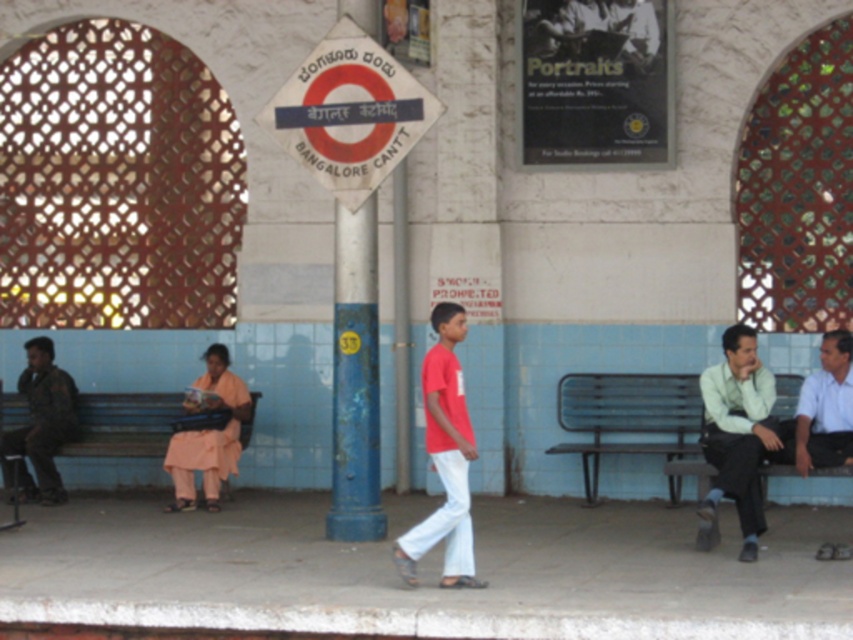
Question: Is white plastic sign at center to the right of blue painted metal pole at center from the viewer's perspective?

Choices:
 (A) no
 (B) yes

Answer: (A)

Question: Based on their relative distances, which object is farther from the red matte shirt at center?

Choices:
 (A) white plastic sign at center
 (B) matte pink dress at center
 (C) dark brown leather jacket at left
 (D) blue painted metal pole at center

Answer: (C)

Question: Is blue painted metal pole at center above light green shirt at right?

Choices:
 (A) no
 (B) yes

Answer: (B)

Question: Which point is farther to the camera?

Choices:
 (A) red matte shirt at center
 (B) matte pink dress at center
 (C) blue painted wood bench at center left

Answer: (C)

Question: Is light green shirt at right to the left of matte pink dress at center from the viewer's perspective?

Choices:
 (A) yes
 (B) no

Answer: (B)

Question: Which object is the farthest from the white plastic sign at center?

Choices:
 (A) dark brown leather jacket at left
 (B) metallic park bench at right
 (C) red matte shirt at center

Answer: (A)